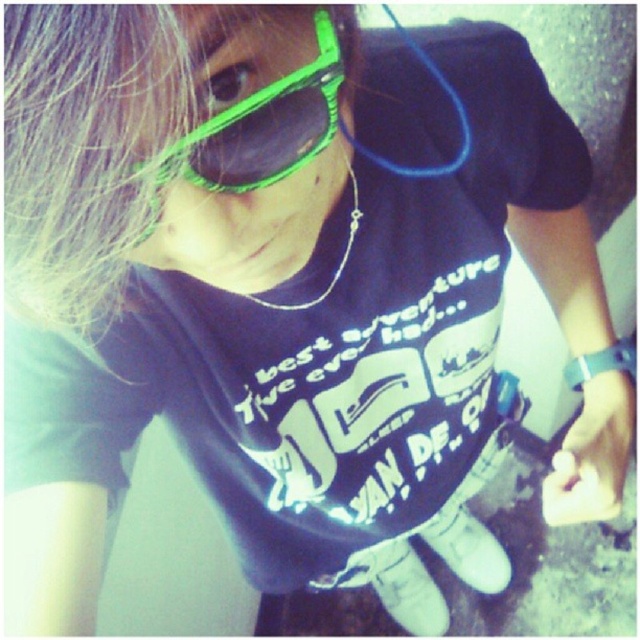
You are a photographer trying to focus on the blonde hair at upper left of the person in the image. If the camera has a focus grid divided into 9 equal squares, which square should you aim the focus point at?

The blonde hair at upper left is located at point coordinates of 0.225 on the x axis and 0.130 on the y axis. Since the focus grid is divided into 9 equal squares, the coordinates would fall into the top left square of the grid.

You are a photographer adjusting your camera settings to capture the details of the blonde hair at upper left and the green plastic goggles at upper center. Which object should you focus on first to ensure both are in sharp focus?

You should focus on the blonde hair at upper left first because it is closer to the viewer than the green plastic goggles at upper center. By focusing on the closer object, the goggles will fall within the depth of field and remain sharp.

You are a photographer trying to capture a portrait of the person in the image. The camera you are using has a minimum focusing distance of 10 inches. If you want to focus on the blonde hair at upper left, will you be able to do so without moving closer?

The blonde hair at upper left and camera are 9.47 inches apart, which is within the camera minimum focusing distance of 10 inches. Therefore, you can focus on the blonde hair at upper left without moving closer.